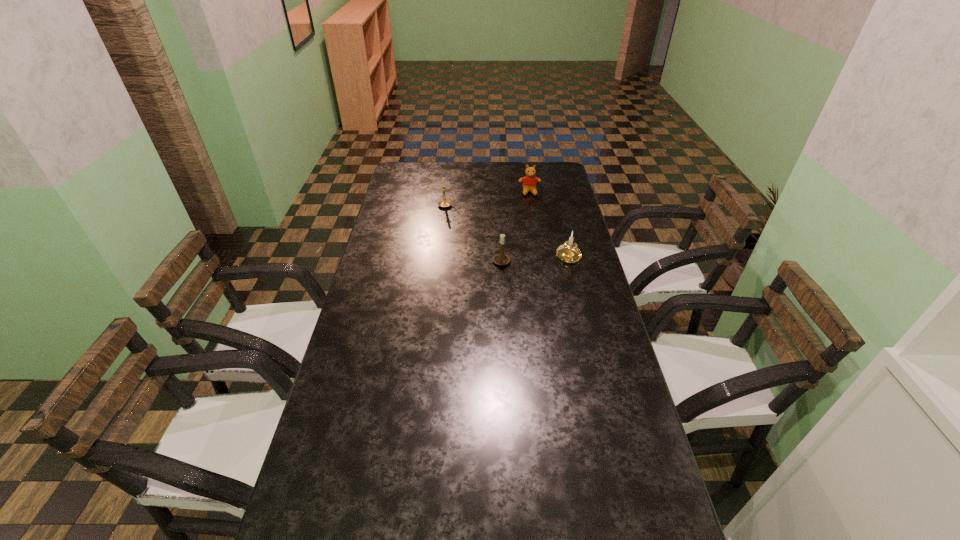
Locate an element on the screen. the farthest candle holder is located at coordinates (444, 203).

Where is `the leftmost candle holder`? the leftmost candle holder is located at coordinates (444, 203).

Identify the location of the farthest object. The image size is (960, 540). 529,182.

Locate an element on the screen. Image resolution: width=960 pixels, height=540 pixels. teddy bear is located at coordinates (529, 182).

Where is `the third object from right to left`? the third object from right to left is located at coordinates (500, 259).

Find the location of a particular element. This screenshot has width=960, height=540. the rightmost object is located at coordinates (568, 252).

What are the coordinates of `free space located 0.230m on the handle side of the second farthest object` in the screenshot? It's located at (512, 205).

You are a GUI agent. You are given a task and a screenshot of the screen. Output one action in this format:
    pyautogui.click(x=<x>, y=<y>)
    Task: Click on the free space located on the front-facing side of the third object from left to right
    
    Given the screenshot: What is the action you would take?
    pyautogui.click(x=536, y=230)

You are a GUI agent. You are given a task and a screenshot of the screen. Output one action in this format:
    pyautogui.click(x=<x>, y=<y>)
    Task: Click on the free spot located 0.280m on the side of the third object from right to left with the handle
    This screenshot has width=960, height=540.
    Given the screenshot: What is the action you would take?
    (x=506, y=331)

Identify the location of free spot located on the handle side of the rightmost object. The height and width of the screenshot is (540, 960). (578, 292).